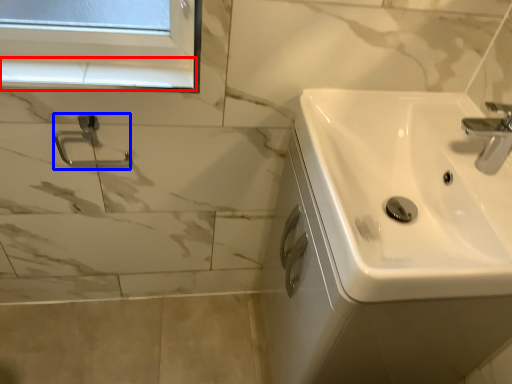
Question: Which point is further to the camera, window sill (highlighted by a red box) or shower (highlighted by a blue box)?

Choices:
 (A) window sill
 (B) shower

Answer: (B)